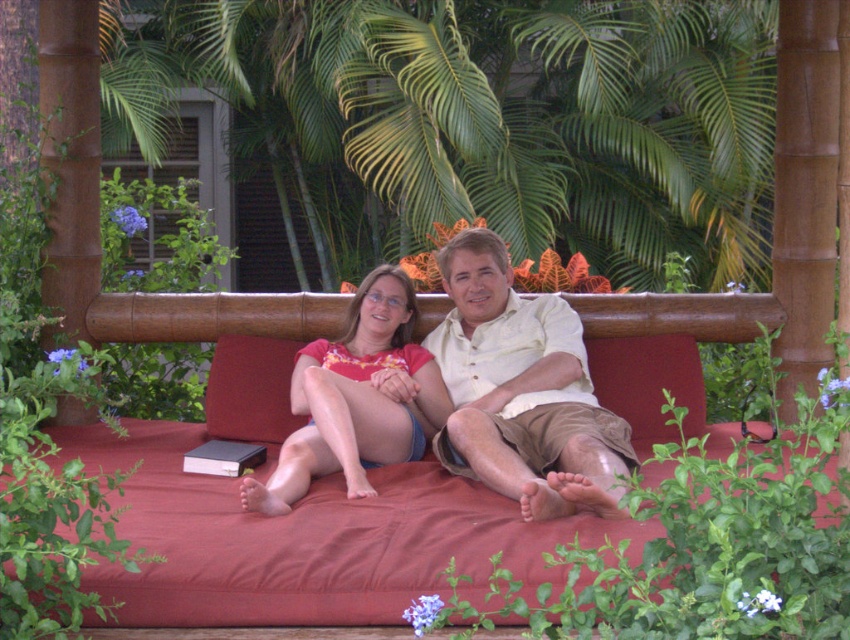
Which is above, light beige cotton shirt at center or matte orange shirt at center?

light beige cotton shirt at center is higher up.

Does light beige cotton shirt at center appear over matte orange shirt at center?

Yes, light beige cotton shirt at center is above matte orange shirt at center.

Between point (593, 458) and point (391, 278), which one is positioned behind?

The point (391, 278) is behind.

I want to click on light beige cotton shirt at center, so click(x=520, y=390).